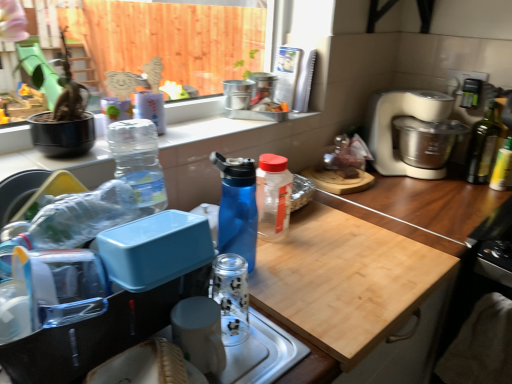
Question: From the image's perspective, would you say wooden cutting board at center is shown under metallic silver canisters at upper center, which appears as the second appliance when ordered from the bottom?

Choices:
 (A) no
 (B) yes

Answer: (B)

Question: Is the depth of wooden cutting board at center greater than that of metallic silver canisters at upper center, which appears as the second appliance when ordered from the bottom?

Choices:
 (A) no
 (B) yes

Answer: (A)

Question: Is wooden cutting board at center beside metallic silver canisters at upper center, which appears as the 1th appliance when viewed from the back?

Choices:
 (A) yes
 (B) no

Answer: (B)

Question: Does wooden cutting board at center have a lesser height compared to metallic silver canisters at upper center, which appears as the 1th appliance when viewed from the back?

Choices:
 (A) no
 (B) yes

Answer: (A)

Question: Considering the relative sizes of wooden cutting board at center and metallic silver canisters at upper center, the 2th appliance when ordered from front to back, in the image provided, is wooden cutting board at center smaller than metallic silver canisters at upper center, the 2th appliance when ordered from front to back,?

Choices:
 (A) yes
 (B) no

Answer: (B)

Question: From the image's perspective, is metallic silver canisters at upper center, the first appliance from the right, positioned above or below dark green glass bottle at right, the 4th bottle from the left?

Choices:
 (A) below
 (B) above

Answer: (B)

Question: From a real-world perspective, is metallic silver canisters at upper center, marked as the second appliance in a left-to-right arrangement, physically located above or below dark green glass bottle at right, which is counted as the 2th bottle, starting from the right?

Choices:
 (A) above
 (B) below

Answer: (A)

Question: Is metallic silver canisters at upper center, which appears as the 1th appliance when viewed from the back, spatially inside dark green glass bottle at right, which is counted as the 2th bottle, starting from the right, or outside of it?

Choices:
 (A) outside
 (B) inside

Answer: (A)

Question: Considering the relative positions of metallic silver canisters at upper center, which is the first appliance in top-to-bottom order, and dark green glass bottle at right, the 1th bottle viewed from the back, in the image provided, is metallic silver canisters at upper center, which is the first appliance in top-to-bottom order, to the left or to the right of dark green glass bottle at right, the 1th bottle viewed from the back,?

Choices:
 (A) right
 (B) left

Answer: (B)

Question: In terms of width, does beige plastic food processor at right look wider or thinner when compared to green glass bottle at right, which is the 1th bottle in right-to-left order?

Choices:
 (A) wide
 (B) thin

Answer: (A)

Question: From a real-world perspective, is beige plastic food processor at right above or below green glass bottle at right, the 4th bottle viewed from the front?

Choices:
 (A) above
 (B) below

Answer: (A)

Question: Relative to green glass bottle at right, the fifth bottle when ordered from left to right, is beige plastic food processor at right in front or behind?

Choices:
 (A) behind
 (B) front

Answer: (B)

Question: Is beige plastic food processor at right bigger or smaller than green glass bottle at right, which appears as the second bottle when viewed from the back?

Choices:
 (A) big
 (B) small

Answer: (A)

Question: Looking at their shapes, would you say transparent plastic bottle at center, the third bottle positioned from the right, is wider or thinner than beige plastic food processor at right?

Choices:
 (A) wide
 (B) thin

Answer: (B)

Question: From the image's perspective, relative to beige plastic food processor at right, is transparent plastic bottle at center, the third bottle positioned from the right, above or below?

Choices:
 (A) below
 (B) above

Answer: (A)